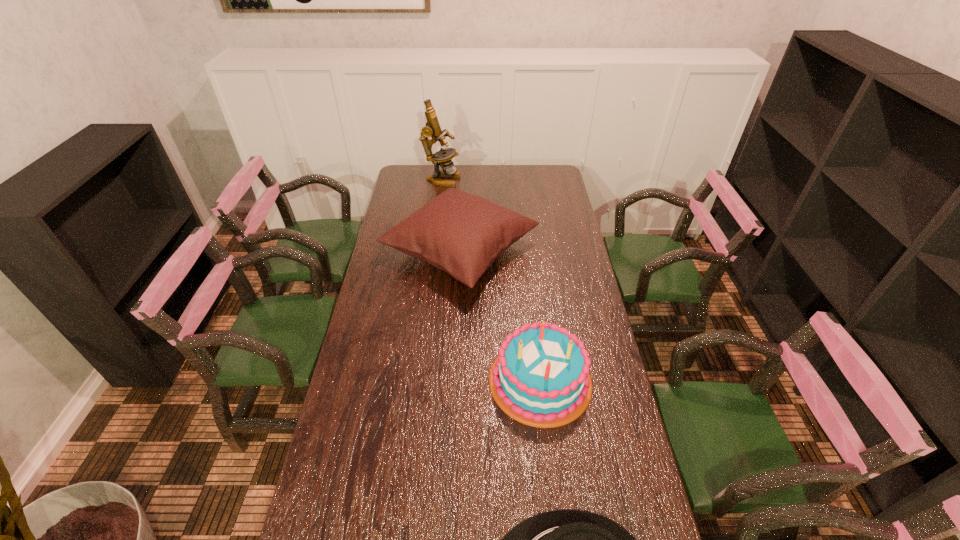
The width and height of the screenshot is (960, 540). Identify the location of object that is at the right edge. (542, 377).

Locate an element on the screen. The image size is (960, 540). object that is at the far left corner is located at coordinates (443, 157).

The image size is (960, 540). I want to click on vacant space at the left edge of the desktop, so click(x=365, y=331).

The width and height of the screenshot is (960, 540). In order to click on free space at the right edge of the desktop in this screenshot , I will do `click(588, 490)`.

Find the location of a particular element. This screenshot has width=960, height=540. vacant point located between the cushion and the birthday cake is located at coordinates (500, 315).

I want to click on vacant point located between the farthest object and the birthday cake, so click(x=491, y=280).

Identify the location of vacant space that's between the second nearest object and the cushion. (500, 315).

The height and width of the screenshot is (540, 960). What are the coordinates of `empty space between the cushion and the birthday cake` in the screenshot? It's located at (500, 315).

At what (x,y) coordinates should I click in order to perform the action: click on object that stands as the second closest to the birthday cake. Please return your answer as a coordinate pair (x, y). The image size is (960, 540). Looking at the image, I should click on (563, 539).

Select which object appears as the closest to the tallest object. Please provide its 2D coordinates. Your answer should be formatted as a tuple, i.e. [(x, y)], where the tuple contains the x and y coordinates of a point satisfying the conditions above.

[(462, 234)]